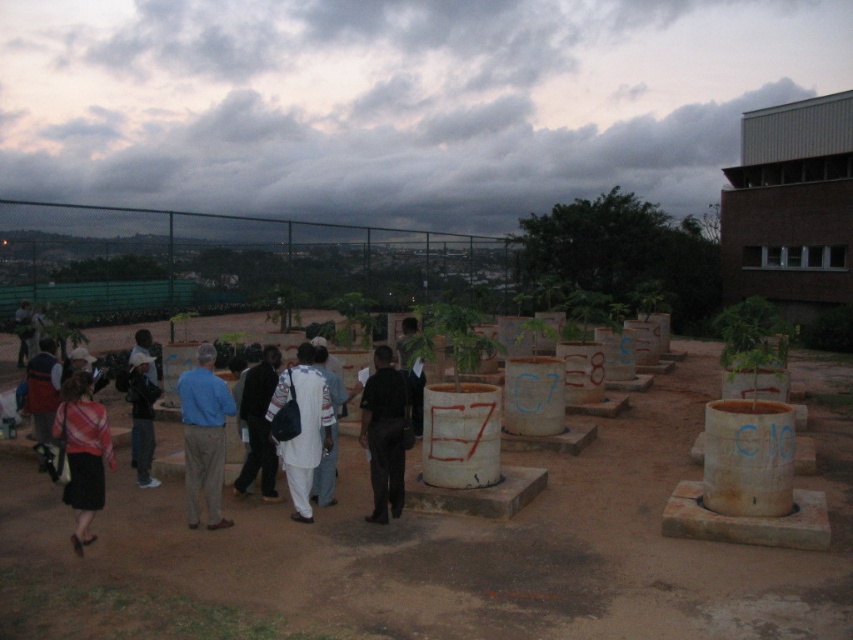
Question: Is black smooth jacket at center above light brown fabric shirt at center?

Choices:
 (A) yes
 (B) no

Answer: (B)

Question: Estimate the real-world distances between objects in this image. Which object is farther from the light brown leather jacket at center?

Choices:
 (A) light brown fabric shirt at center
 (B) brown dirt field at center
 (C) blue fabric pants at center

Answer: (C)

Question: Where is brown dirt field at center located in relation to white cotton dress at center in the image?

Choices:
 (A) above
 (B) below

Answer: (B)

Question: Which point appears closest to the camera in this image?

Choices:
 (A) (152, 371)
 (B) (262, 381)
 (C) (341, 392)

Answer: (B)

Question: Which object appears farthest from the camera in this image?

Choices:
 (A) light brown fabric shirt at center
 (B) dark blue shirt at center

Answer: (B)

Question: Does black matte shirt at center appear under matte black shirt at center?

Choices:
 (A) no
 (B) yes

Answer: (B)